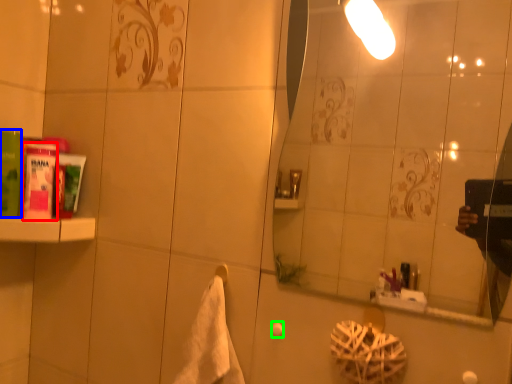
Question: Based on their relative distances, which object is nearer to mouthwash (highlighted by a red box)? Choose from mouthwash (highlighted by a blue box) and towel bar (highlighted by a green box).

Choices:
 (A) mouthwash
 (B) towel bar

Answer: (A)